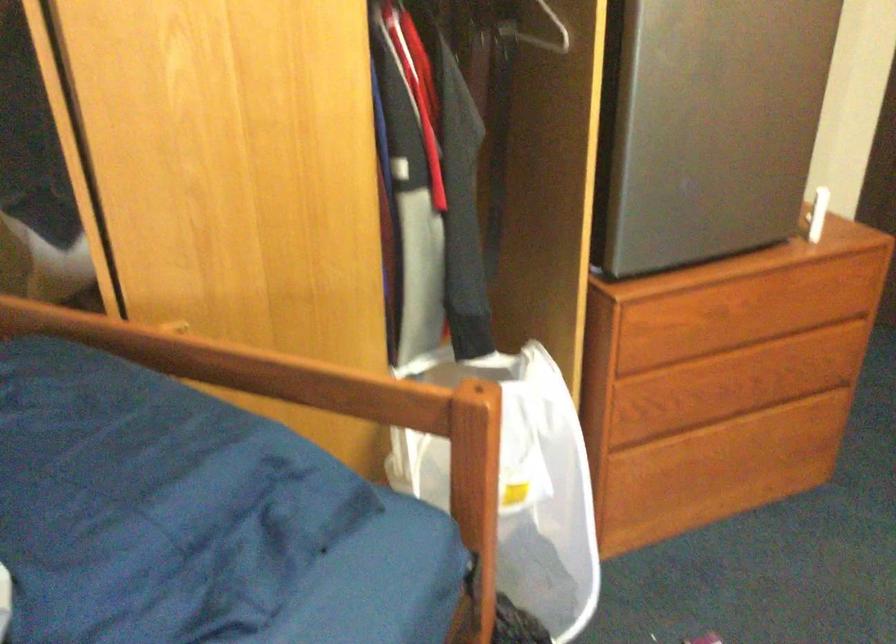
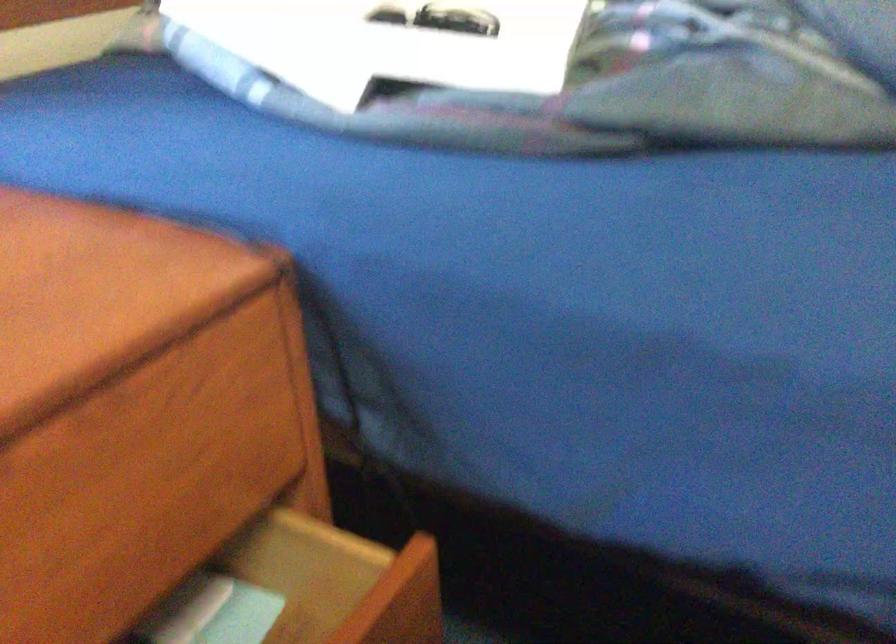
The first image is from the beginning of the video and the second image is from the end. How did the camera likely rotate when shooting the video?

The rotation direction of the camera is left-down.